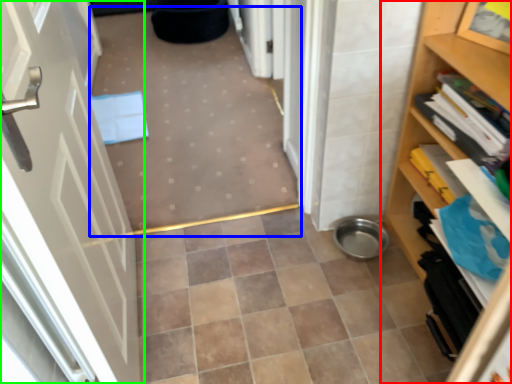
Question: Which object is positioned farthest from shelf (highlighted by a red box)? Select from plain (highlighted by a blue box) and door (highlighted by a green box).

Choices:
 (A) plain
 (B) door

Answer: (A)